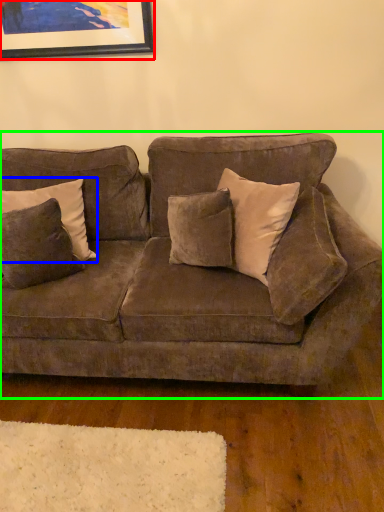
Question: Estimate the real-world distances between objects in this image. Which object is closer to picture frame (highlighted by a red box), pillow (highlighted by a blue box) or studio couch (highlighted by a green box)?

Choices:
 (A) pillow
 (B) studio couch

Answer: (A)